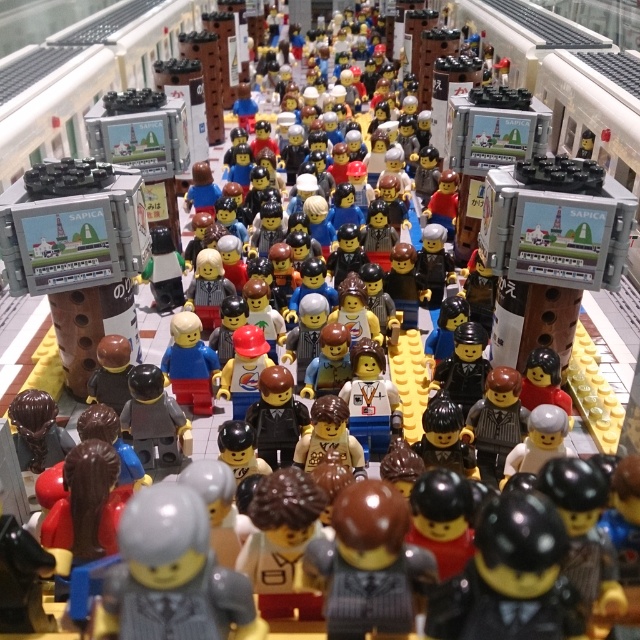
You are a LEGO minifigure trying to locate the person in the matte gray suit at center. Based on the coordinates provided, can you determine their position relative to the SAPICA sign?

The matte gray suit at center is located at coordinates point (x=172, y=576). However, without knowing the exact position of the SAPICA sign, it is impossible to determine their relative positions.

You are standing at the entrance of the SAPICA transportation hub. You see a black glossy minifigure at center. Where exactly is the black glossy minifigure located in relation to your current position?

The black glossy minifigure at center is located at coordinates point (509, 577) relative to your position at the entrance.

What are the coordinates of the brown fabric minifigure at center in the image?

The coordinates of the brown fabric minifigure at center are at point (368, 563).